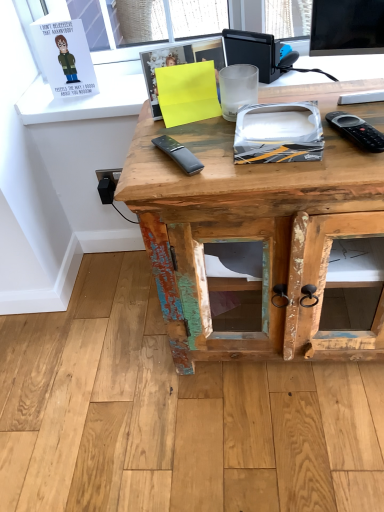
Find the location of `unoccupied region to the right of matte paper card at upper left, which is counted as the 1th book, starting from the top`. unoccupied region to the right of matte paper card at upper left, which is counted as the 1th book, starting from the top is located at coordinates (122, 89).